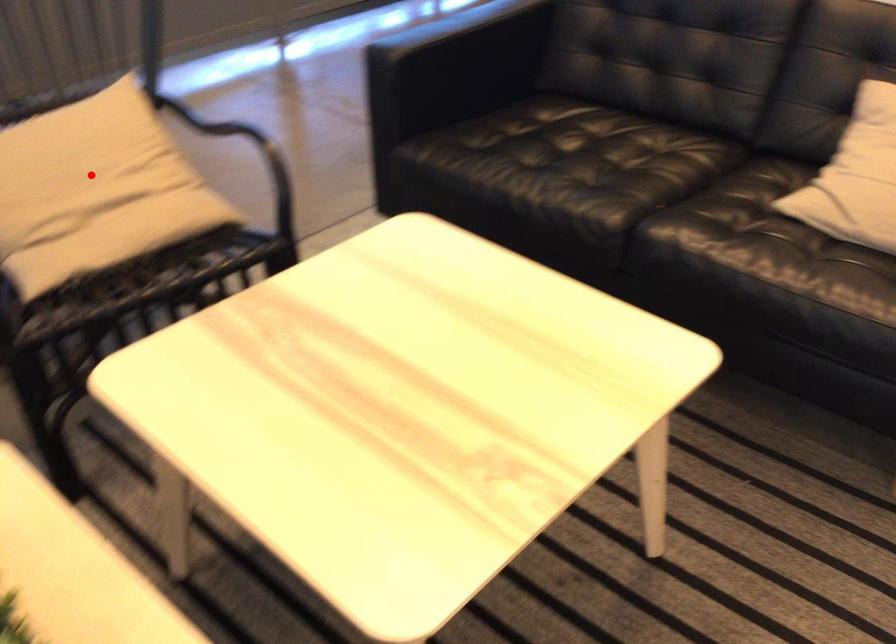
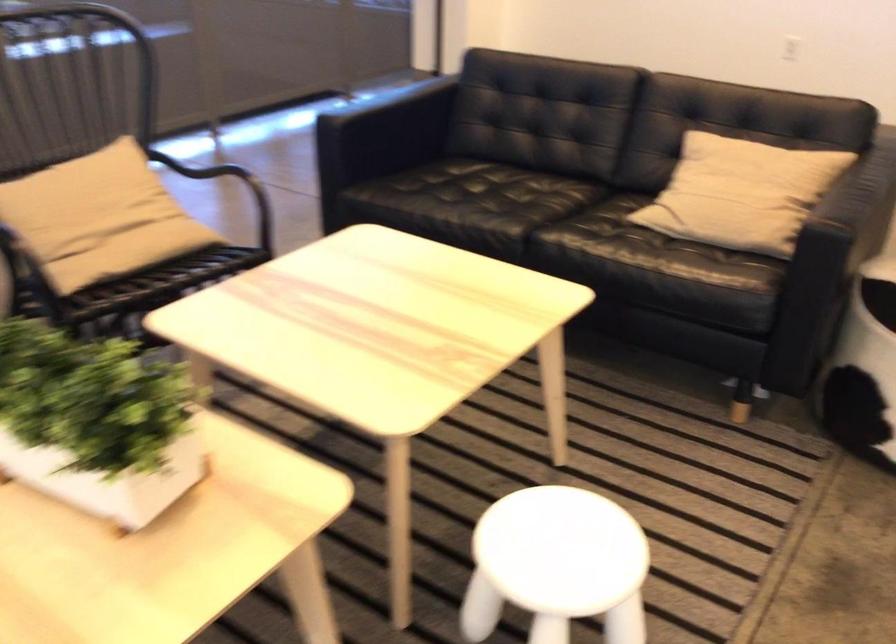
Question: I am providing you with two images of the same scene from different viewpoints. Given a red point in image1, look at the same physical point in image2. Is it:

Choices:
 (A) Closer to the viewpoint
 (B) Farther from the viewpoint

Answer: (B)